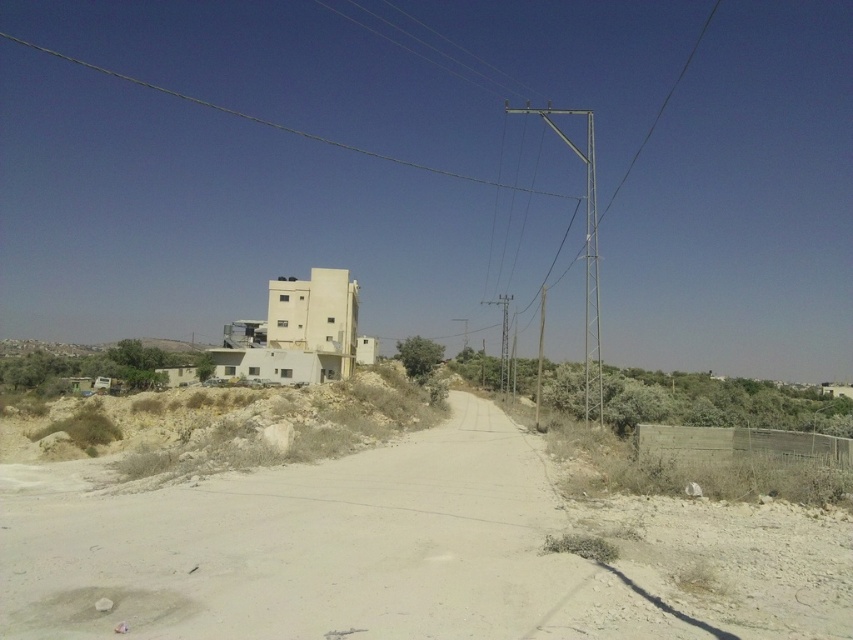
Where is `dusty sand road at center`? Image resolution: width=853 pixels, height=640 pixels. dusty sand road at center is located at coordinates (405, 552).

Is dusty sand road at center wider than silver metallic pole at center-right?

Incorrect, dusty sand road at center's width does not surpass silver metallic pole at center-right's.

Identify the location of dusty sand road at center. The image size is (853, 640). (405, 552).